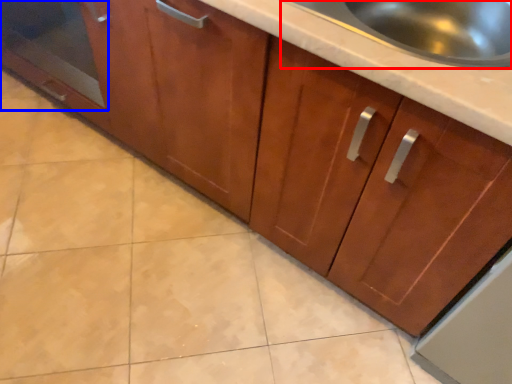
Question: Among these objects, which one is farthest to the camera, sink (highlighted by a red box) or glass door (highlighted by a blue box)?

Choices:
 (A) sink
 (B) glass door

Answer: (B)